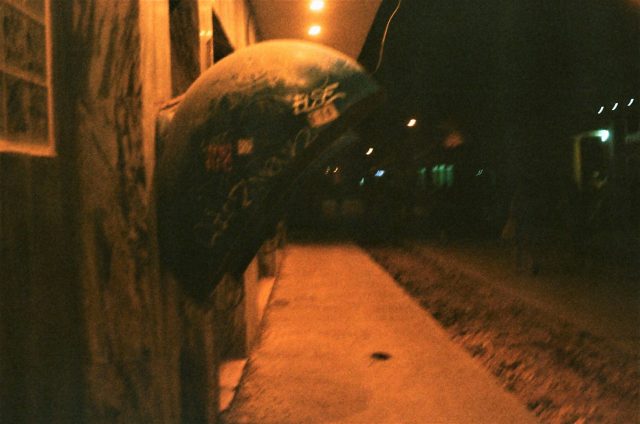
You are a GUI agent. You are given a task and a screenshot of the screen. Output one action in this format:
    pyautogui.click(x=<x>, y=<y>)
    Task: Click on the window
    
    Given the screenshot: What is the action you would take?
    pyautogui.click(x=38, y=118)